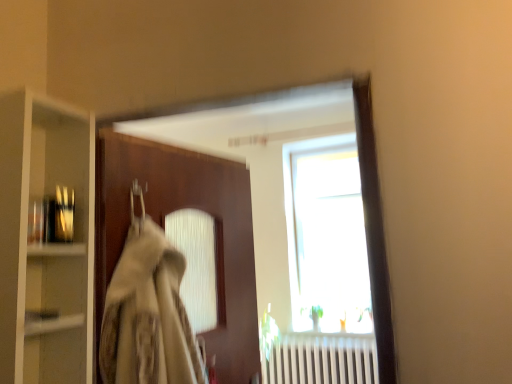
Question: From the image's perspective, is brown wooden door at center beneath metallic glass bottles at left?

Choices:
 (A) yes
 (B) no

Answer: (A)

Question: Does brown wooden door at center lie behind metallic glass bottles at left?

Choices:
 (A) yes
 (B) no

Answer: (A)

Question: Does brown wooden door at center have a larger size compared to metallic glass bottles at left?

Choices:
 (A) yes
 (B) no

Answer: (A)

Question: From a real-world perspective, is brown wooden door at center positioned under metallic glass bottles at left based on gravity?

Choices:
 (A) no
 (B) yes

Answer: (B)

Question: Considering the relative positions of brown wooden door at center and metallic glass bottles at left in the image provided, is brown wooden door at center to the right of metallic glass bottles at left from the viewer's perspective?

Choices:
 (A) no
 (B) yes

Answer: (B)

Question: Is brown wooden door at center smaller than metallic glass bottles at left?

Choices:
 (A) yes
 (B) no

Answer: (B)

Question: Is clear glass cabinet at left to the right of brown wooden door at center from the viewer's perspective?

Choices:
 (A) yes
 (B) no

Answer: (B)

Question: Considering the relative positions of clear glass cabinet at left and brown wooden door at center in the image provided, is clear glass cabinet at left in front of brown wooden door at center?

Choices:
 (A) yes
 (B) no

Answer: (A)

Question: Could you tell me if clear glass cabinet at left is facing brown wooden door at center?

Choices:
 (A) no
 (B) yes

Answer: (A)

Question: Does clear glass cabinet at left have a lesser height compared to brown wooden door at center?

Choices:
 (A) no
 (B) yes

Answer: (B)

Question: Would you consider clear glass cabinet at left to be distant from brown wooden door at center?

Choices:
 (A) yes
 (B) no

Answer: (B)

Question: Would you say brown wooden door at center is part of clear glass cabinet at left's contents?

Choices:
 (A) no
 (B) yes

Answer: (A)

Question: Is metallic glass bottles at left thinner than clear glass cabinet at left?

Choices:
 (A) no
 (B) yes

Answer: (B)